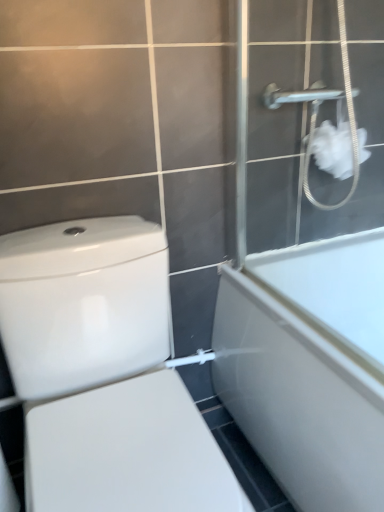
Question: Would you say white matte shower screen at upper right is outside white fluffy tissue at upper right?

Choices:
 (A) yes
 (B) no

Answer: (A)

Question: Does white matte shower screen at upper right appear on the right side of white fluffy tissue at upper right?

Choices:
 (A) yes
 (B) no

Answer: (A)

Question: Can you see white matte shower screen at upper right touching white fluffy tissue at upper right?

Choices:
 (A) no
 (B) yes

Answer: (A)

Question: Considering the relative sizes of white matte shower screen at upper right and white fluffy tissue at upper right in the image provided, is white matte shower screen at upper right bigger than white fluffy tissue at upper right?

Choices:
 (A) yes
 (B) no

Answer: (A)

Question: Could you tell me if white matte shower screen at upper right is turned towards white fluffy tissue at upper right?

Choices:
 (A) no
 (B) yes

Answer: (B)

Question: Can you confirm if white matte shower screen at upper right is taller than white fluffy tissue at upper right?

Choices:
 (A) no
 (B) yes

Answer: (B)

Question: Considering the relative positions of white matte shower screen at upper right and white glossy bathtub at right in the image provided, is white matte shower screen at upper right to the left of white glossy bathtub at right from the viewer's perspective?

Choices:
 (A) no
 (B) yes

Answer: (B)

Question: Considering the relative sizes of white matte shower screen at upper right and white glossy bathtub at right in the image provided, is white matte shower screen at upper right shorter than white glossy bathtub at right?

Choices:
 (A) no
 (B) yes

Answer: (B)

Question: From a real-world perspective, is white matte shower screen at upper right positioned over white glossy bathtub at right based on gravity?

Choices:
 (A) no
 (B) yes

Answer: (B)

Question: Is white matte shower screen at upper right oriented towards white glossy bathtub at right?

Choices:
 (A) no
 (B) yes

Answer: (A)

Question: Is white matte shower screen at upper right facing away from white glossy bathtub at right?

Choices:
 (A) yes
 (B) no

Answer: (B)

Question: Is white matte shower screen at upper right beside white glossy bathtub at right?

Choices:
 (A) yes
 (B) no

Answer: (B)

Question: Considering the relative sizes of white glossy toilet at lower left and white fluffy tissue at upper right in the image provided, is white glossy toilet at lower left bigger than white fluffy tissue at upper right?

Choices:
 (A) no
 (B) yes

Answer: (B)